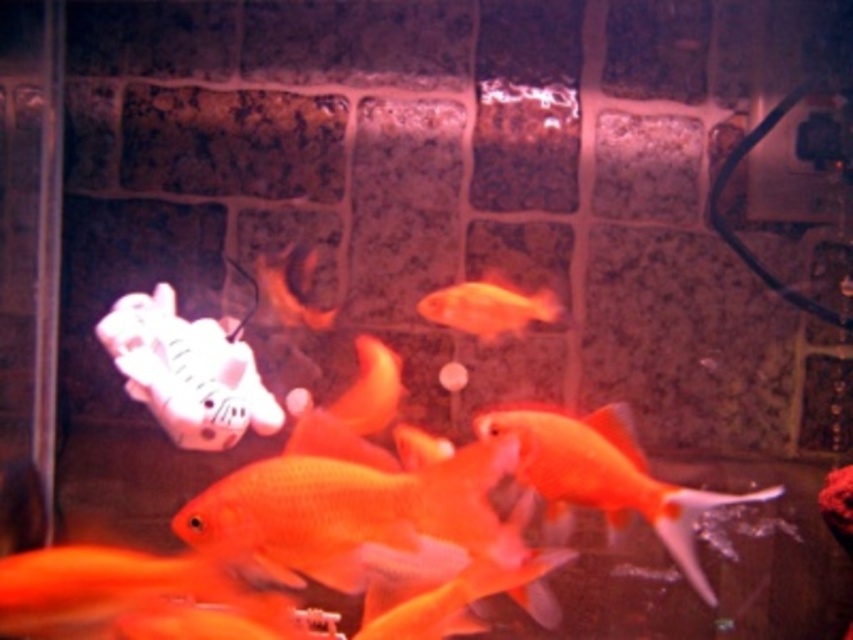
Question: Among these points, which one is nearest to the camera?

Choices:
 (A) (508, 284)
 (B) (659, 529)

Answer: (B)

Question: Can you confirm if glossy orange goldfish at center is thinner than orange matte goldfish at center?

Choices:
 (A) no
 (B) yes

Answer: (A)

Question: Which point is closer to the camera?

Choices:
 (A) glossy orange goldfish at center
 (B) orange matte goldfish at center

Answer: (A)

Question: Can you confirm if glossy orange goldfish at center is positioned to the left of orange matte goldfish at center?

Choices:
 (A) no
 (B) yes

Answer: (A)

Question: Does glossy orange goldfish at center have a smaller size compared to orange matte goldfish at center?

Choices:
 (A) yes
 (B) no

Answer: (B)